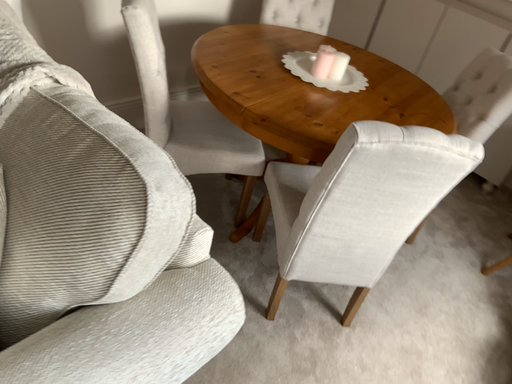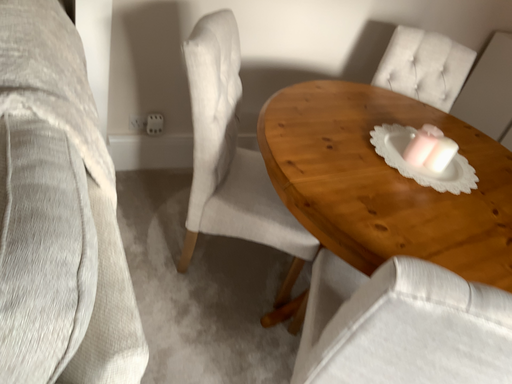
Question: Which way did the camera rotate in the video?

Choices:
 (A) rotated left
 (B) rotated right

Answer: (A)